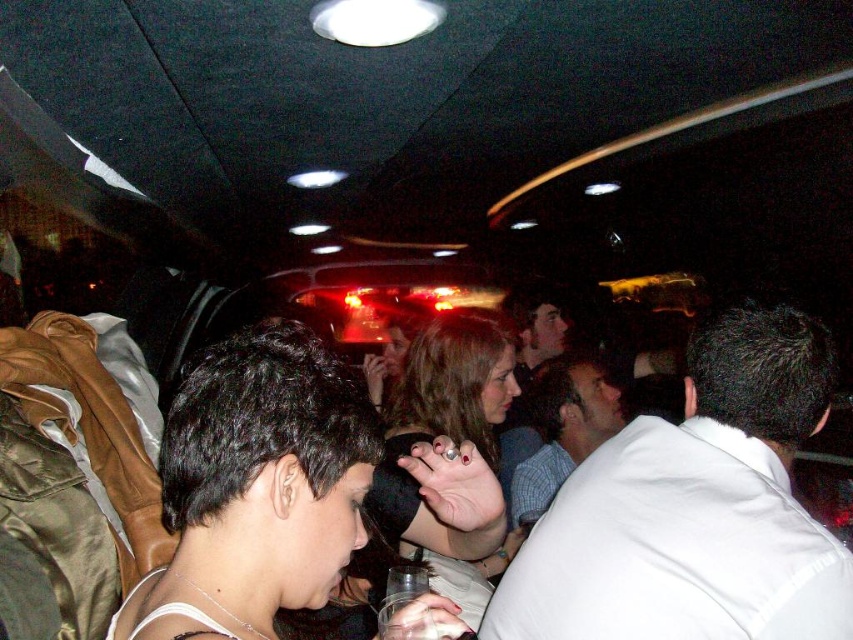
Question: Can you confirm if white cotton shirt at center is bigger than white shirt at center?

Choices:
 (A) yes
 (B) no

Answer: (B)

Question: Which object is farther from the camera taking this photo?

Choices:
 (A) white shirt at center
 (B) white cotton shirt at center

Answer: (A)

Question: Does white cotton shirt at center lie behind white shirt at center?

Choices:
 (A) yes
 (B) no

Answer: (B)

Question: Which object is farther from the camera taking this photo?

Choices:
 (A) white cotton shirt at center
 (B) white shirt at center

Answer: (B)

Question: Does white cotton shirt at center appear on the left side of white shirt at center?

Choices:
 (A) yes
 (B) no

Answer: (B)

Question: Which object appears farthest from the camera in this image?

Choices:
 (A) white shirt at center
 (B) white cotton shirt at center

Answer: (A)